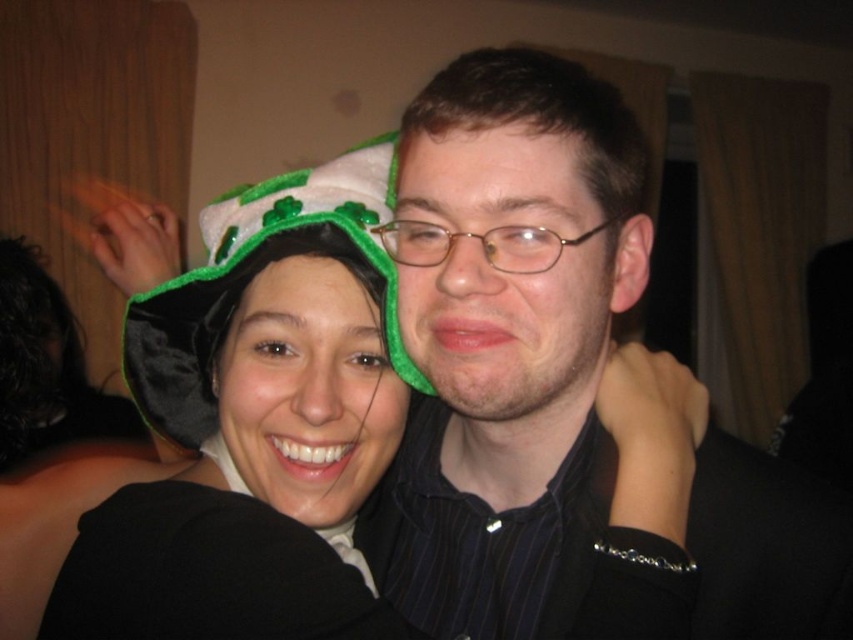
Question: Considering the relative positions of velvet hat at center and velvet green hat at center in the image provided, where is velvet hat at center located with respect to velvet green hat at center?

Choices:
 (A) left
 (B) right

Answer: (B)

Question: Observing the image, what is the correct spatial positioning of velvet hat at center in reference to velvet green hat at center?

Choices:
 (A) above
 (B) below

Answer: (B)

Question: Can you confirm if velvet hat at center is positioned above velvet green hat at center?

Choices:
 (A) yes
 (B) no

Answer: (B)

Question: Which point is closer to the camera?

Choices:
 (A) 154,616
 (B) 158,332

Answer: (A)

Question: Among these points, which one is farthest from the camera?

Choices:
 (A) (172, 566)
 (B) (189, 380)

Answer: (B)